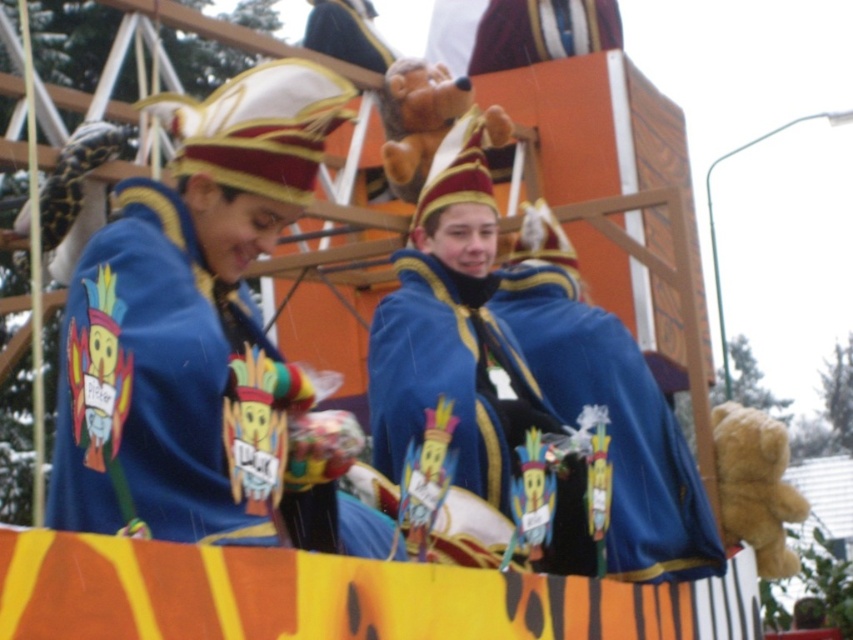
Question: Which point is closer to the camera?

Choices:
 (A) (508, 424)
 (B) (106, 225)

Answer: (A)

Question: Which point appears closest to the camera in this image?

Choices:
 (A) (206, 337)
 (B) (483, 458)

Answer: (A)

Question: Does blue velvet cape at center have a greater width compared to matte blue cape at center?

Choices:
 (A) no
 (B) yes

Answer: (B)

Question: Is blue velvet cape at center positioned at the back of matte blue cape at center?

Choices:
 (A) yes
 (B) no

Answer: (B)

Question: Can you confirm if blue velvet cape at center is bigger than matte blue cape at center?

Choices:
 (A) no
 (B) yes

Answer: (A)